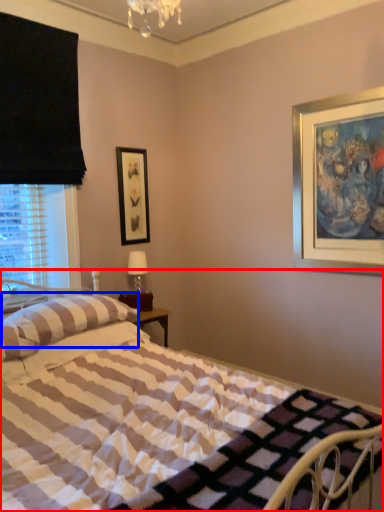
Question: Which of the following is the closest to the observer, bed (highlighted by a red box) or pillow (highlighted by a blue box)?

Choices:
 (A) bed
 (B) pillow

Answer: (A)